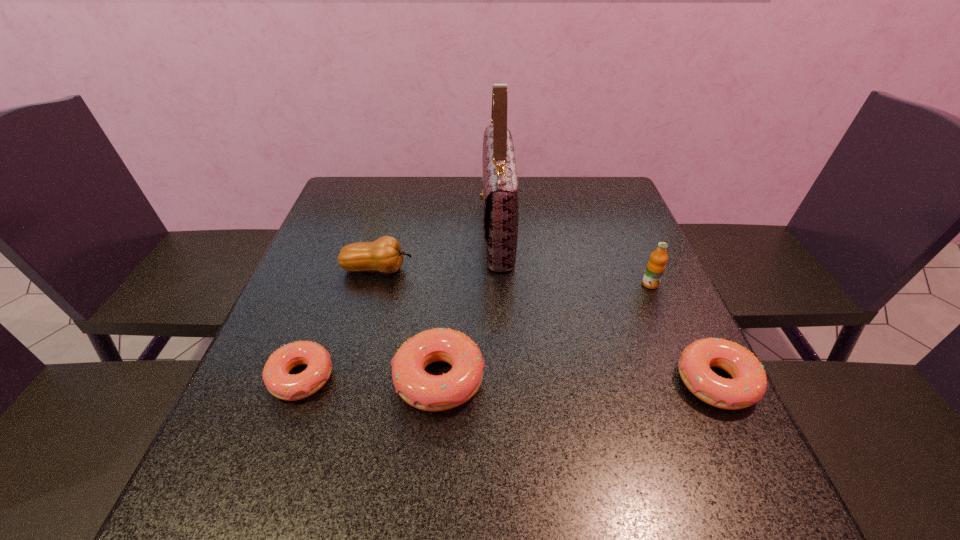
Please point a location where one more doughnut can be added evenly. Please provide its 2D coordinates. Your answer should be formatted as a tuple, i.e. [(x, y)], where the tuple contains the x and y coordinates of a point satisfying the conditions above.

[(577, 381)]